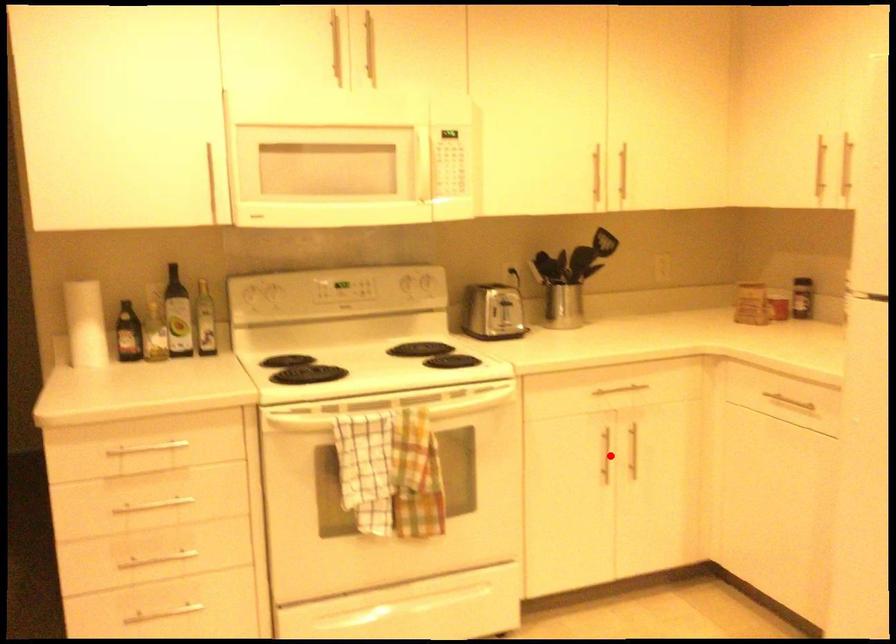
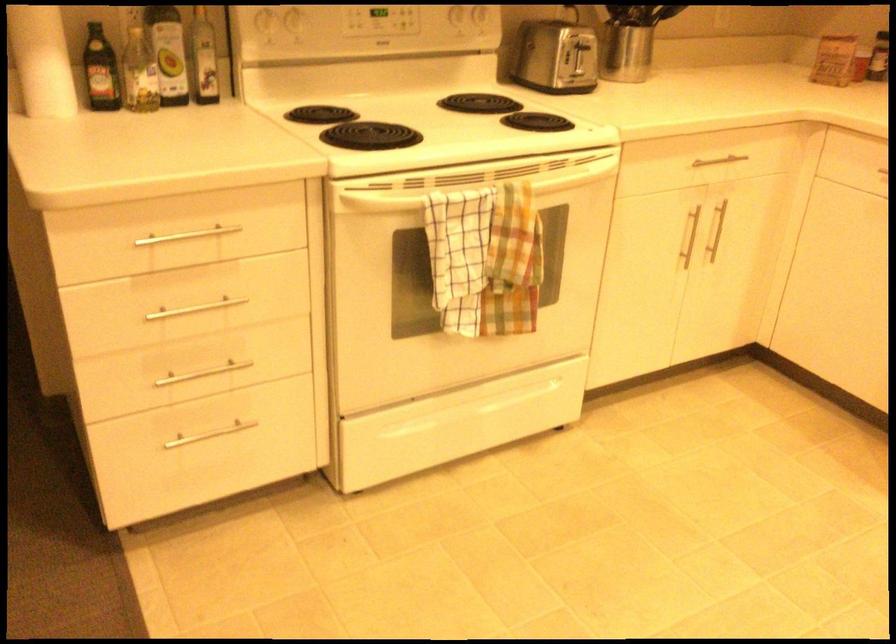
Question: I am providing you with two images of the same scene from different viewpoints. In image1, a red point is highlighted. Considering the same 3D point in image2, which of the following is correct?

Choices:
 (A) It is closer
 (B) It is farther

Answer: (A)